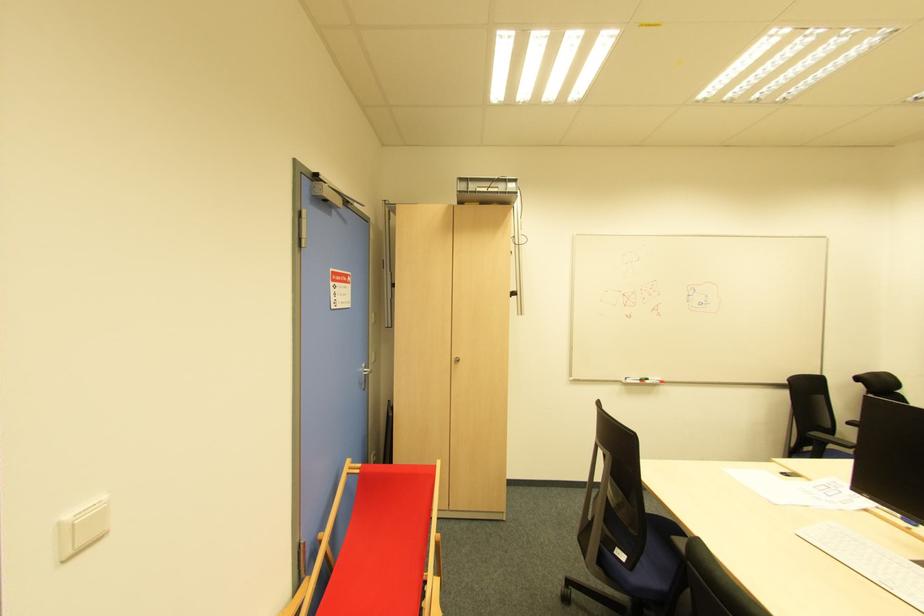
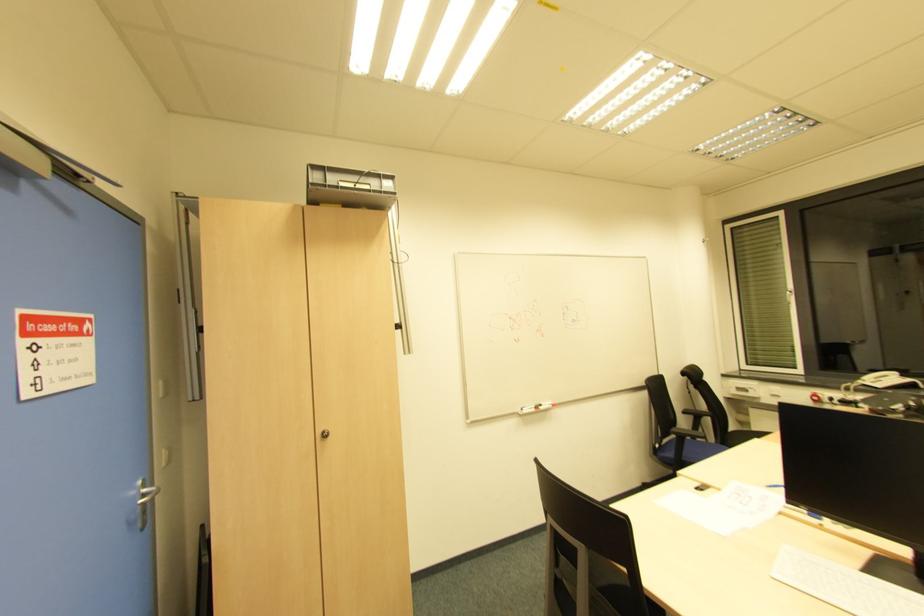
Question: In a continuous first-person perspective shot, in which direction is the camera moving?

Choices:
 (A) Left
 (B) Right
 (C) Forward
 (D) Backward

Answer: (C)